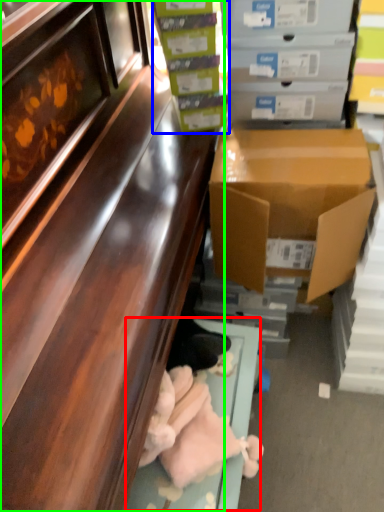
Question: Which object is the farthest from window sill (highlighted by a red box)? Choose among these: box (highlighted by a blue box) or cabinetry (highlighted by a green box).

Choices:
 (A) box
 (B) cabinetry

Answer: (A)